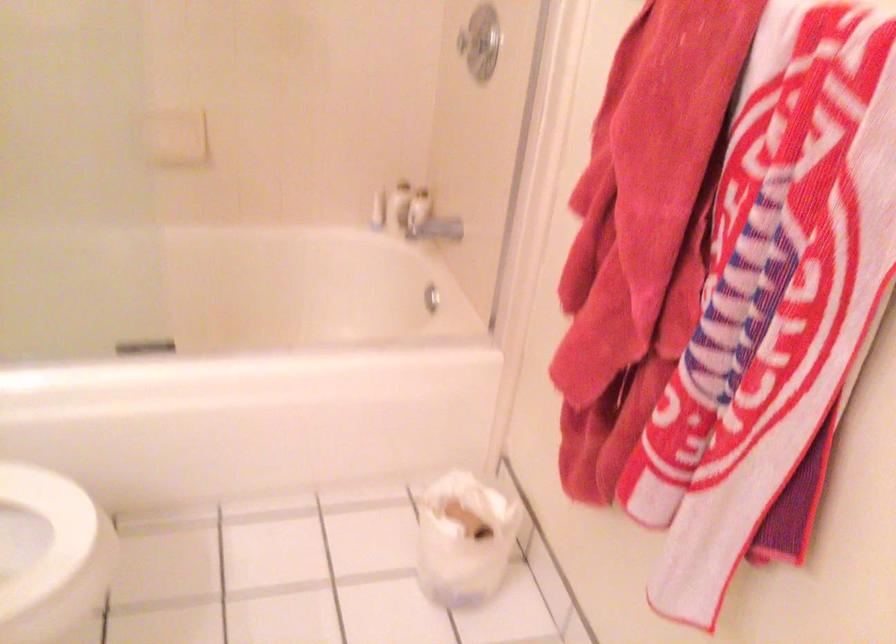
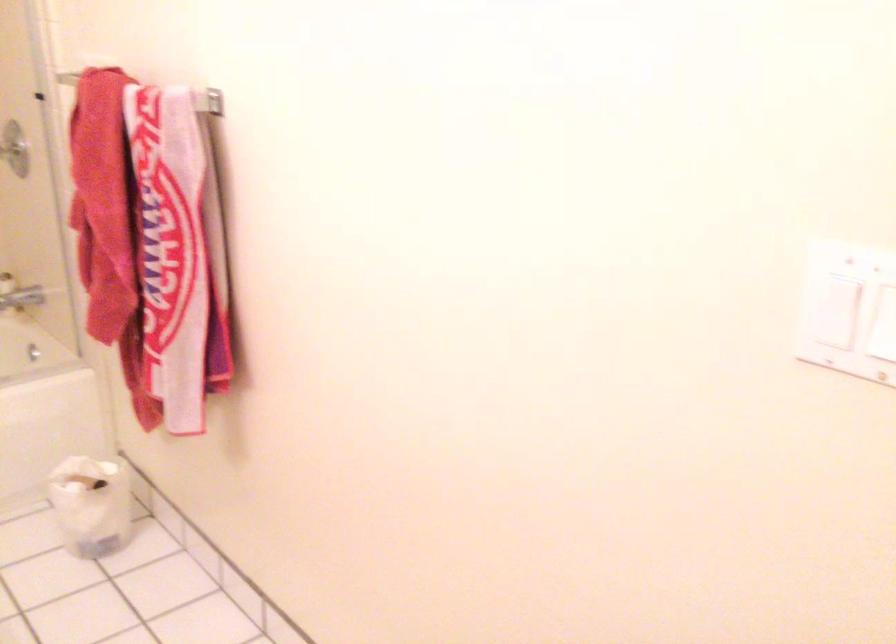
Question: The camera is either moving clockwise (left) or counter-clockwise (right) around the object. The first image is from the beginning of the video and the second image is from the end. Is the camera moving left or right when shooting the video?

Choices:
 (A) Left
 (B) Right

Answer: (A)